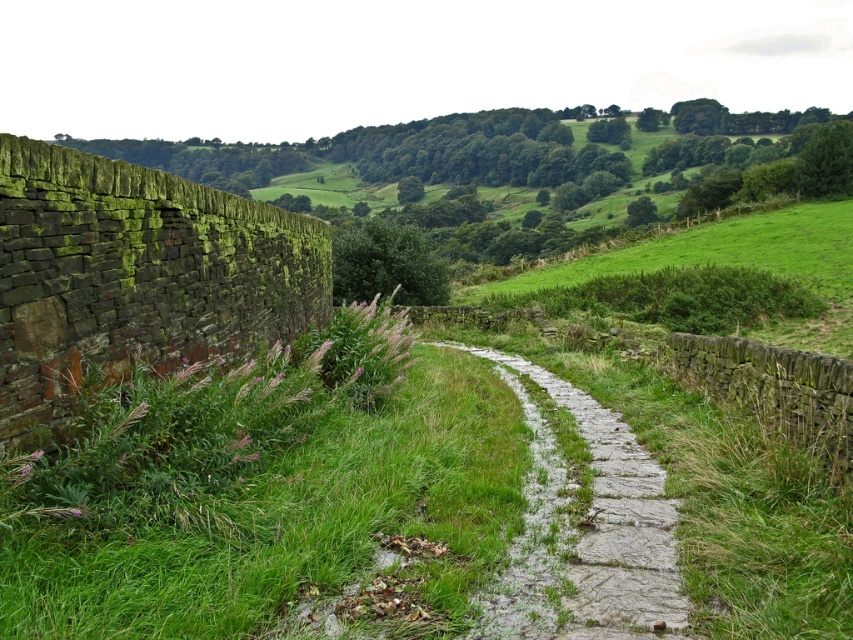
Does green mossy stone wall at left appear under gray stone path at center?

No, green mossy stone wall at left is not below gray stone path at center.

Does point (286, 323) lie behind point (621, 620)?

Yes, it is.

Locate an element on the screen. This screenshot has height=640, width=853. green mossy stone wall at left is located at coordinates (135, 275).